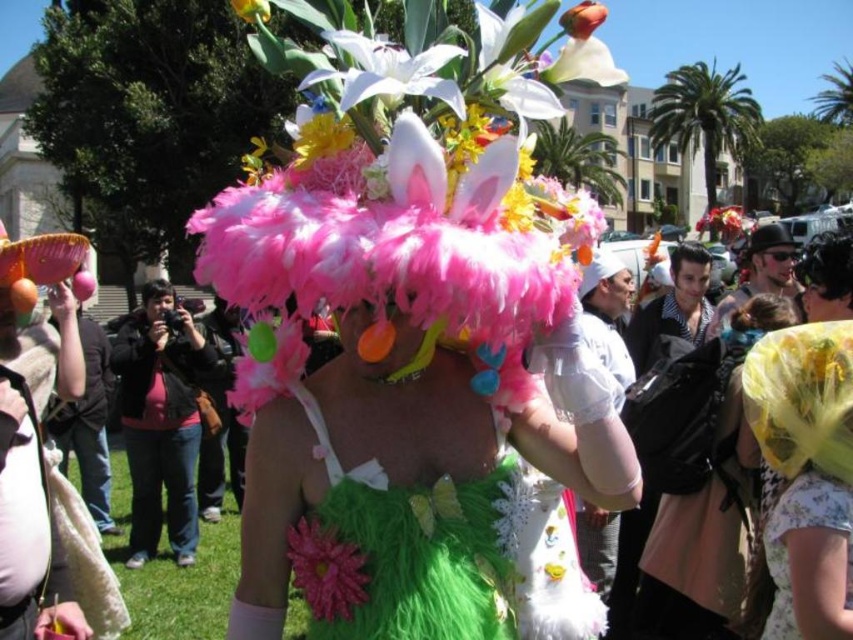
Question: Which point is farther to the camera?

Choices:
 (A) matte black hair at center
 (B) fluffy pink feathers at center

Answer: (A)

Question: Does feathered pink hat at center appear under shiny black hair at center?

Choices:
 (A) yes
 (B) no

Answer: (B)

Question: Among these points, which one is farthest from the camera?

Choices:
 (A) (694, 252)
 (B) (788, 234)

Answer: (A)

Question: Can you confirm if feathered pink hat at center is thinner than matte black hair at center?

Choices:
 (A) yes
 (B) no

Answer: (B)

Question: Does pink feathered hat at center lie in front of matte black hat at center?

Choices:
 (A) no
 (B) yes

Answer: (A)

Question: Which point appears closest to the camera in this image?

Choices:
 (A) (804, 362)
 (B) (784, 227)
 (C) (653, 472)
 (D) (320, 202)

Answer: (D)